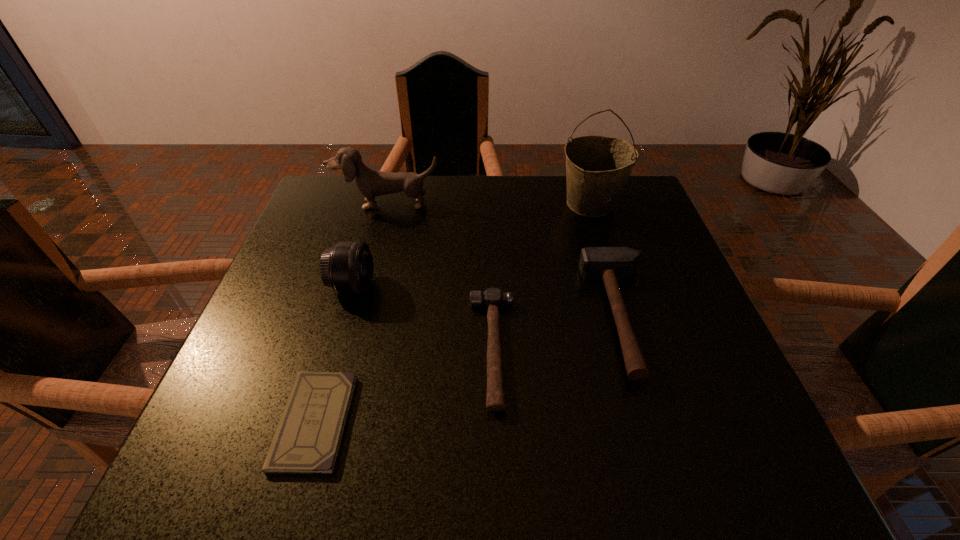
I want to click on vacant space at the near edge of the desktop, so [614, 479].

In the image, there is a desktop. Find the location of `vacant region at the left edge`. vacant region at the left edge is located at coordinates (289, 335).

The width and height of the screenshot is (960, 540). I want to click on free space at the right edge of the desktop, so click(x=716, y=416).

Locate an element on the screen. vacant region at the far left corner of the desktop is located at coordinates (355, 194).

The width and height of the screenshot is (960, 540). Identify the location of free space between the shorter hammer and the right hammer. (558, 333).

I want to click on blank region between the second tallest object and the fifth tallest object, so click(440, 276).

Where is `free area in between the wine bucket and the puppy`? The image size is (960, 540). free area in between the wine bucket and the puppy is located at coordinates (489, 204).

Locate an element on the screen. The height and width of the screenshot is (540, 960). free space between the telephoto lens and the checkbook is located at coordinates (334, 354).

This screenshot has width=960, height=540. Find the location of `free space between the third tallest object and the shortest object`. free space between the third tallest object and the shortest object is located at coordinates (334, 354).

Identify the location of vacant area that lies between the checkbook and the telephoto lens. Image resolution: width=960 pixels, height=540 pixels. 334,354.